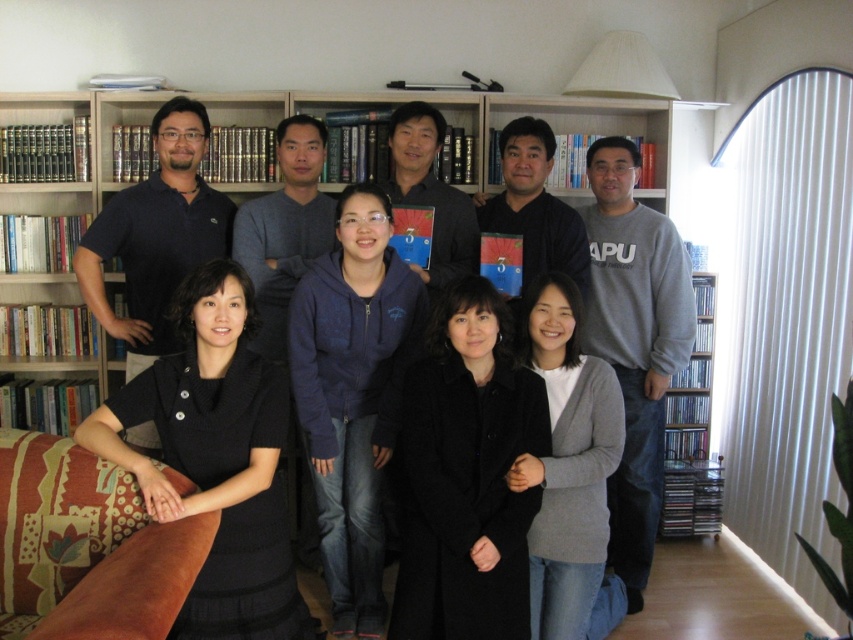
You are a photographer trying to adjust the group photo setup. You notice the black wool coat at center and the gray cotton sweatshirt at right. Which clothing item is located to the left of the other?

The black wool coat at center is positioned on the left side of gray cotton sweatshirt at right.

You are taking a photo of the group and want to focus on the person at point (544,424) and the person at point (419,333). Which of these two people will be in sharper focus if you focus on the closer one?

The person at point (544,424) will be in sharper focus because it is closer to the camera than point (419,333).

You are organizing a photo shoot and need to ensure that the black wool coat at center and the dark blue fleece at center are visible in the final image. Given their sizes, which one might you need to position closer to the camera to ensure it appears the same size as the other in the photo?

The black wool coat at center is smaller than the dark blue fleece at center. To make them appear the same size in the photo, you should position the black wool coat at center closer to the camera than the dark blue fleece at center.